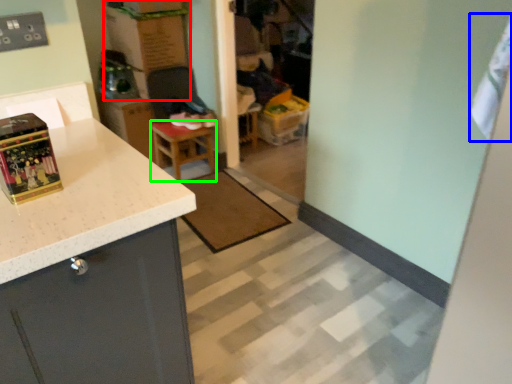
Question: Estimate the real-world distances between objects in this image. Which object is farther from cardboard box (highlighted by a red box), laundry (highlighted by a blue box) or table (highlighted by a green box)?

Choices:
 (A) laundry
 (B) table

Answer: (A)